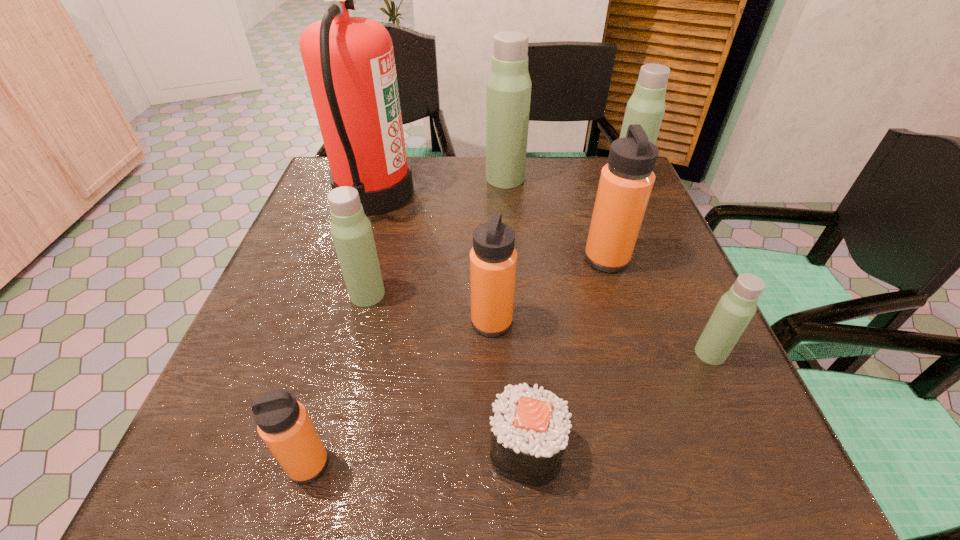
In order to click on the third biggest light thermos bottle in this screenshot , I will do pos(351,230).

You are a GUI agent. You are given a task and a screenshot of the screen. Output one action in this format:
    pyautogui.click(x=<x>, y=<y>)
    Task: Click on the third nearest object
    The image size is (960, 540).
    Given the screenshot: What is the action you would take?
    pyautogui.click(x=735, y=309)

Locate an element on the screen. This screenshot has width=960, height=540. the nearest light thermos bottle is located at coordinates click(735, 309).

This screenshot has width=960, height=540. I want to click on the nearest orange thermos bottle, so [282, 422].

Identify the location of the nearest thermos bottle. The image size is (960, 540). (282, 422).

Locate an element on the screen. The width and height of the screenshot is (960, 540). sushi is located at coordinates (530, 427).

At what (x,y) coordinates should I click in order to perform the action: click on blank space located 0.250m at the nozzle of the fire extinguisher. Please return your answer as a coordinate pair (x, y). This screenshot has height=540, width=960. Looking at the image, I should click on (508, 193).

Where is `free space located on the right of the third light thermos bottle from right to left`? free space located on the right of the third light thermos bottle from right to left is located at coordinates (637, 178).

This screenshot has height=540, width=960. I want to click on free space located 0.160m on the left of the third smallest light thermos bottle, so click(x=551, y=183).

Find the location of a particular element. The height and width of the screenshot is (540, 960). vacant space located on the left of the rightmost orange thermos bottle is located at coordinates (425, 259).